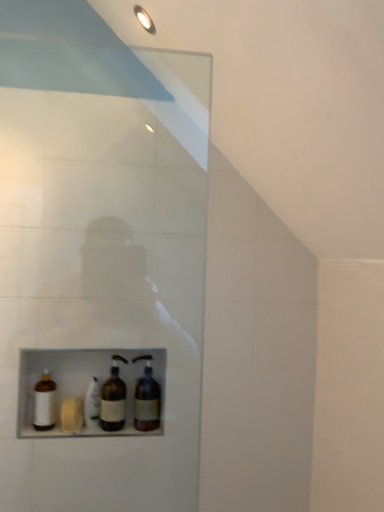
Question: Considering the relative positions of white matte bottle at center, the second bottle from the left, and white matte bottle at lower left, marked as the first bottle in a left-to-right arrangement, in the image provided, is white matte bottle at center, the second bottle from the left, to the left or to the right of white matte bottle at lower left, marked as the first bottle in a left-to-right arrangement,?

Choices:
 (A) left
 (B) right

Answer: (B)

Question: Considering the positions of white matte bottle at center, acting as the third bottle starting from the right, and white matte bottle at lower left, marked as the first bottle in a left-to-right arrangement, in the image, is white matte bottle at center, acting as the third bottle starting from the right, bigger or smaller than white matte bottle at lower left, marked as the first bottle in a left-to-right arrangement,?

Choices:
 (A) big
 (B) small

Answer: (A)

Question: Estimate the real-world distances between objects in this image. Which object is farther from the brown glass bottle at center, which ranks as the first bottle in right-to-left order?

Choices:
 (A) brown glass bottle at center, which appears as the second bottle when viewed from the right
 (B) white matte bottle at lower left, marked as the first bottle in a left-to-right arrangement
 (C) white matte bottle at center, acting as the third bottle starting from the right

Answer: (B)

Question: Which is farther from the brown glass bottle at center, which appears as the second bottle when viewed from the right?

Choices:
 (A) white matte bottle at center, the second bottle from the left
 (B) brown glass bottle at center, placed as the fourth bottle when sorted from left to right
 (C) white matte bottle at lower left, which is counted as the 4th bottle, starting from the right

Answer: (C)